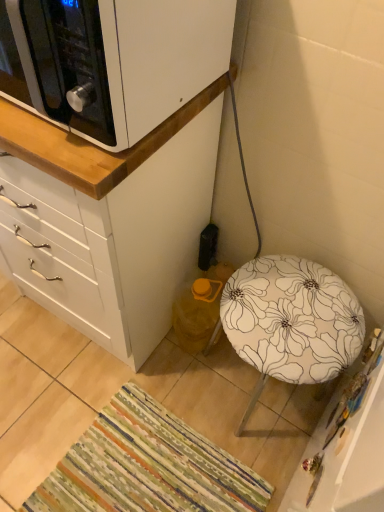
Question: Based on their sizes in the image, would you say white matte cabinet at upper left is bigger or smaller than multicolored woven mat at lower left?

Choices:
 (A) small
 (B) big

Answer: (B)

Question: Is white matte cabinet at upper left spatially inside multicolored woven mat at lower left, or outside of it?

Choices:
 (A) inside
 (B) outside

Answer: (B)

Question: Estimate the real-world distances between objects in this image. Which object is farther from the white floral fabric stool at lower right?

Choices:
 (A) white matte cabinet at upper left
 (B) multicolored woven mat at lower left
 (C) white matte cabinet at upper left
 (D) black plastic electric outlet at lower center

Answer: (A)

Question: Estimate the real-world distances between objects in this image. Which object is farther from the white floral fabric stool at lower right?

Choices:
 (A) black plastic electric outlet at lower center
 (B) white matte cabinet at upper left
 (C) multicolored woven mat at lower left
 (D) white matte cabinet at upper left

Answer: (D)